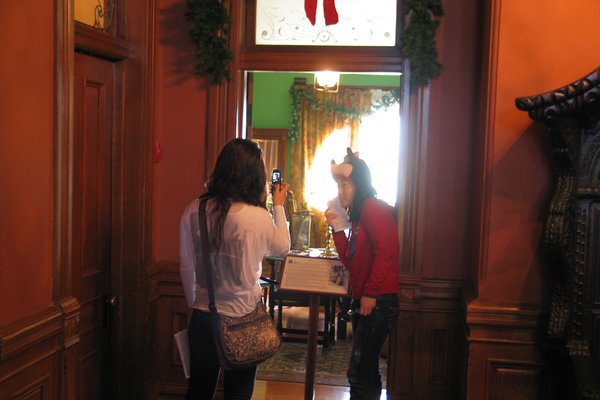
Find the location of a particular element. The width and height of the screenshot is (600, 400). rug is located at coordinates (335, 375).